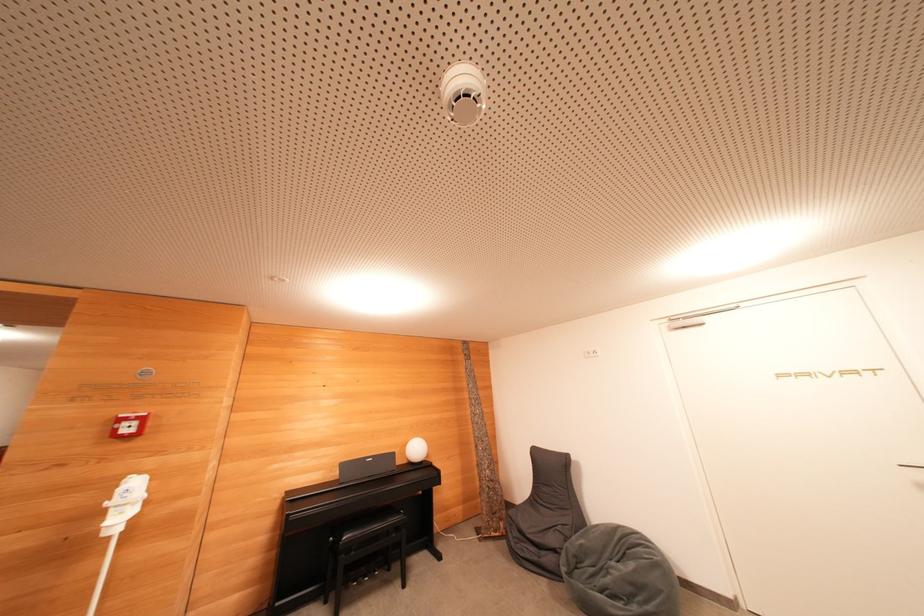
Find the location of a particular element. silver door handle is located at coordinates (910, 469).